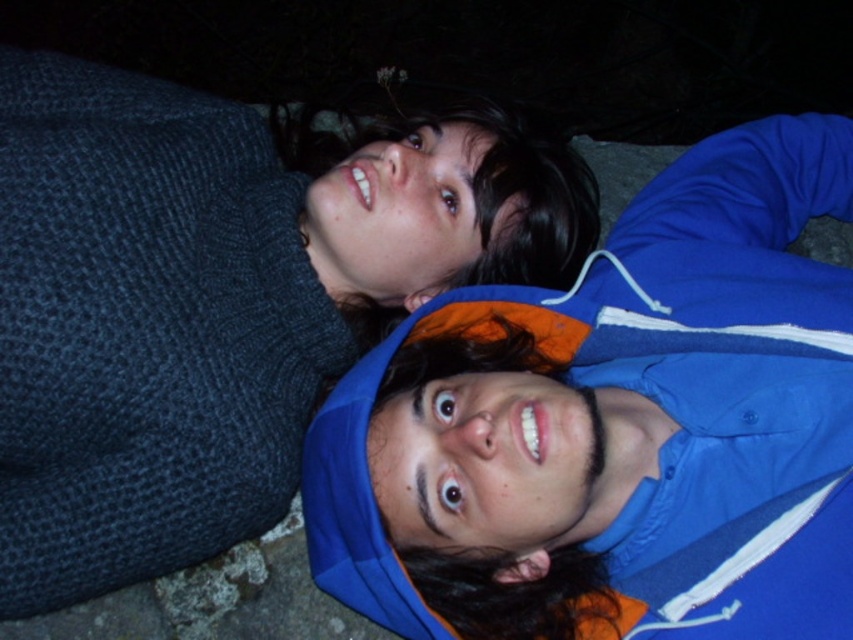
Question: Which point is farther to the camera?

Choices:
 (A) (334, 321)
 (B) (457, 384)

Answer: (A)

Question: Does blue fabric jacket at upper center have a smaller size compared to knitted dark blue sweater at upper left?

Choices:
 (A) no
 (B) yes

Answer: (A)

Question: Is blue fabric jacket at upper center bigger than knitted dark blue sweater at upper left?

Choices:
 (A) no
 (B) yes

Answer: (B)

Question: Does blue fabric jacket at upper center have a larger size compared to knitted dark blue sweater at upper left?

Choices:
 (A) no
 (B) yes

Answer: (B)

Question: Among these objects, which one is farthest from the camera?

Choices:
 (A) knitted dark blue sweater at upper left
 (B) blue fabric jacket at upper center

Answer: (A)

Question: Among these points, which one is farthest from the camera?

Choices:
 (A) (494, 211)
 (B) (688, 177)

Answer: (B)